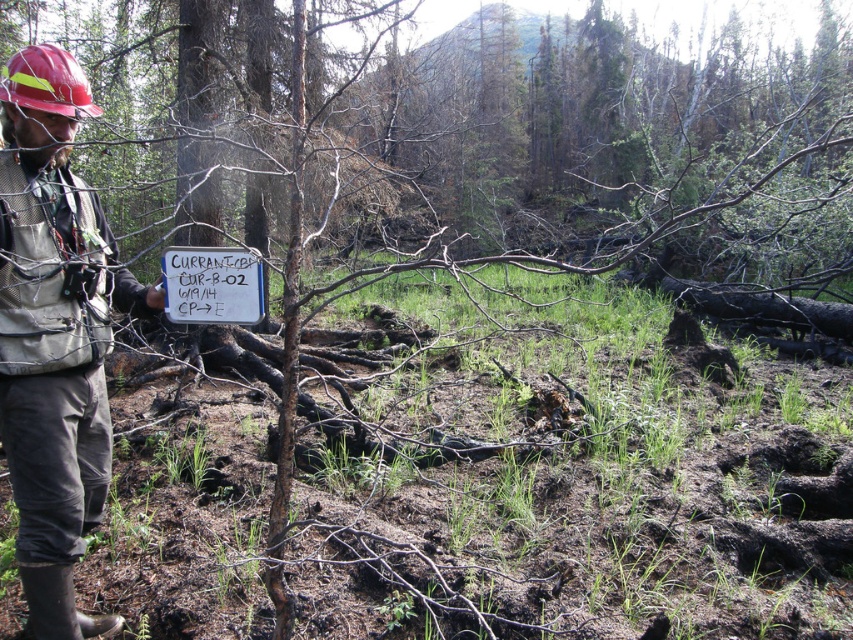
You are a firefighter assessing the fire damage in the forest. You see a white paper sign at center and a red hard hat at upper left. Which object is smaller in size?

The white paper sign at center is smaller in size compared to the red hard hat at upper left.

From the picture: You are a firefighter assessing the fire damage. You see a hard hat at left and a white paper sign at center. Which object is wider?

The hard hat at left might be wider than white paper sign at center.

You are a firefighter assessing the fire damage in the forest. You see a hard hat at left and a white paper sign at center. If your tool is 16 inches long, can you place it between them without touching either?

The hard hat at left and white paper sign at center are 18.75 inches apart. Since your tool is 16 inches long, it can fit between them without touching either object.